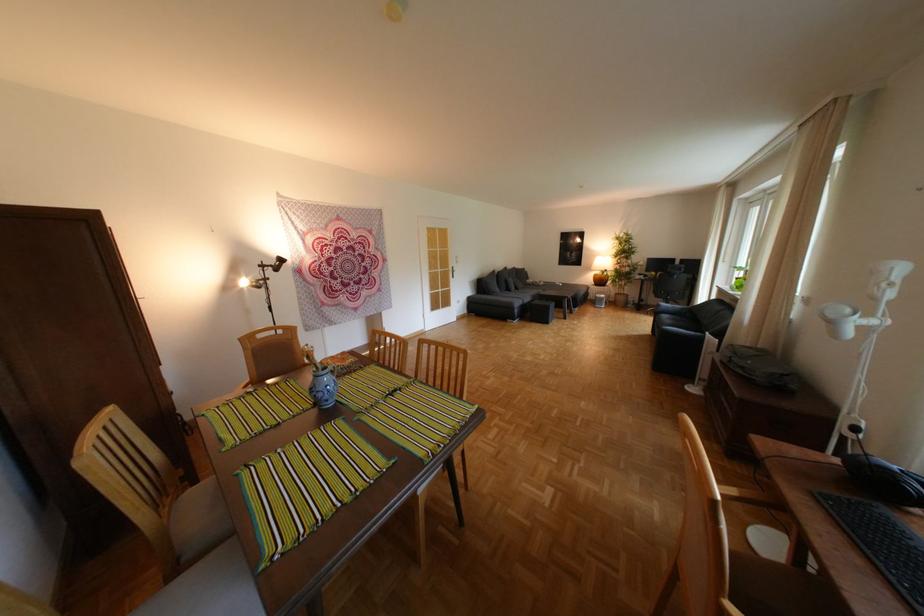
The location [623,265] corresponds to which object?

This point indicates the potted plant.